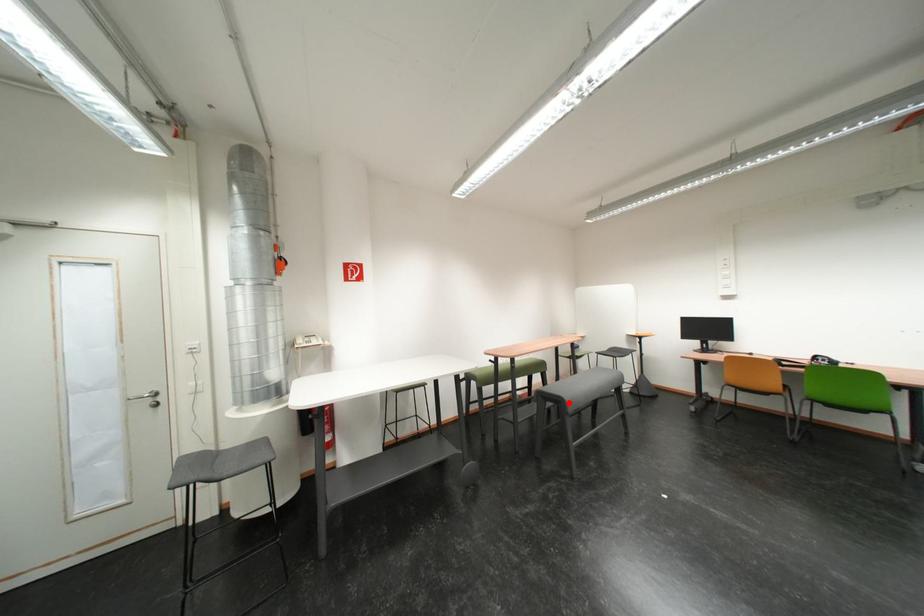
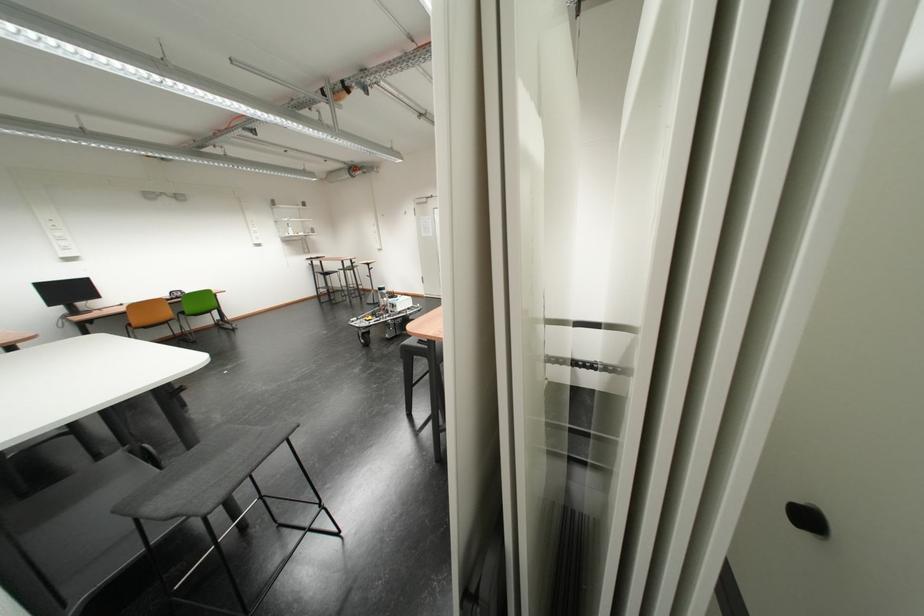
Question: I am providing you with two images of the same scene from different viewpoints. A red point is marked on the first image. Is the red point's position out of view in image 2?

Choices:
 (A) Yes
 (B) No

Answer: (A)